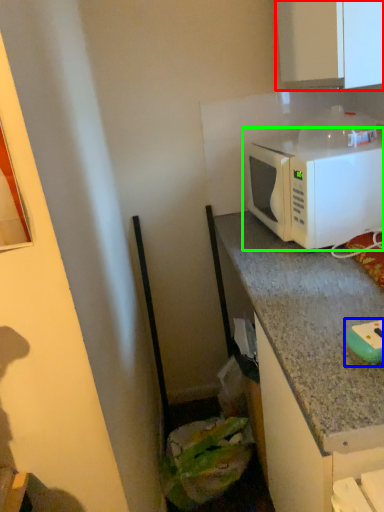
Question: Which object is positioned closest to cabinetry (highlighted by a red box)? Select from appliance (highlighted by a blue box) and microwave oven (highlighted by a green box).

Choices:
 (A) appliance
 (B) microwave oven

Answer: (B)